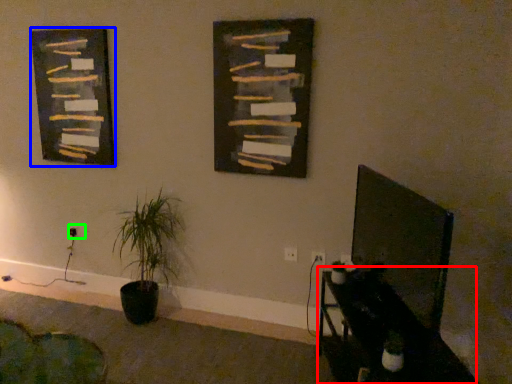
Question: Which is nearer to the table (highlighted by a red box)? picture frame (highlighted by a blue box) or electric outlet (highlighted by a green box).

Choices:
 (A) picture frame
 (B) electric outlet

Answer: (A)